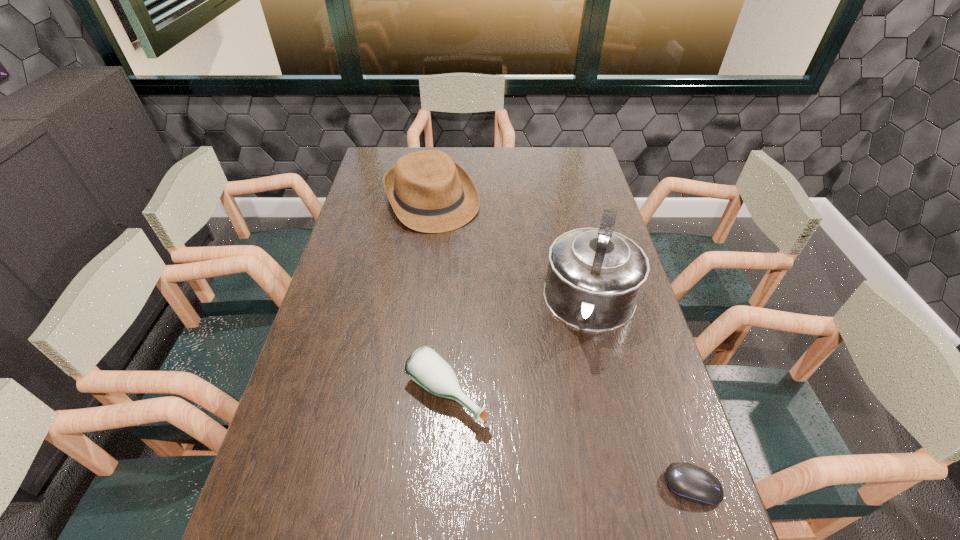
Identify the location of kettle that is at the right edge. The height and width of the screenshot is (540, 960). (594, 278).

You are a GUI agent. You are given a task and a screenshot of the screen. Output one action in this format:
    pyautogui.click(x=<x>, y=<y>)
    Task: Click on the object positioned at the far left corner
    
    Given the screenshot: What is the action you would take?
    pyautogui.click(x=429, y=192)

Where is `object located at the near right corner`? The image size is (960, 540). object located at the near right corner is located at coordinates (692, 483).

I want to click on vacant space at the far edge of the desktop, so click(x=492, y=175).

In the image, there is a desktop. At what (x,y) coordinates should I click in order to perform the action: click on vacant area at the near edge. Please return your answer as a coordinate pair (x, y). The image size is (960, 540). Looking at the image, I should click on (413, 490).

This screenshot has height=540, width=960. In the image, there is a desktop. Find the location of `free space at the left edge`. free space at the left edge is located at coordinates (343, 254).

This screenshot has width=960, height=540. Find the location of `vacant space at the right edge`. vacant space at the right edge is located at coordinates (587, 205).

In the image, there is a desktop. Find the location of `vacant space at the near left corner`. vacant space at the near left corner is located at coordinates (313, 526).

Where is `vacant area between the bottle and the kettle`? The height and width of the screenshot is (540, 960). vacant area between the bottle and the kettle is located at coordinates (519, 350).

The image size is (960, 540). I want to click on empty space between the computer mouse and the fedora, so click(x=563, y=343).